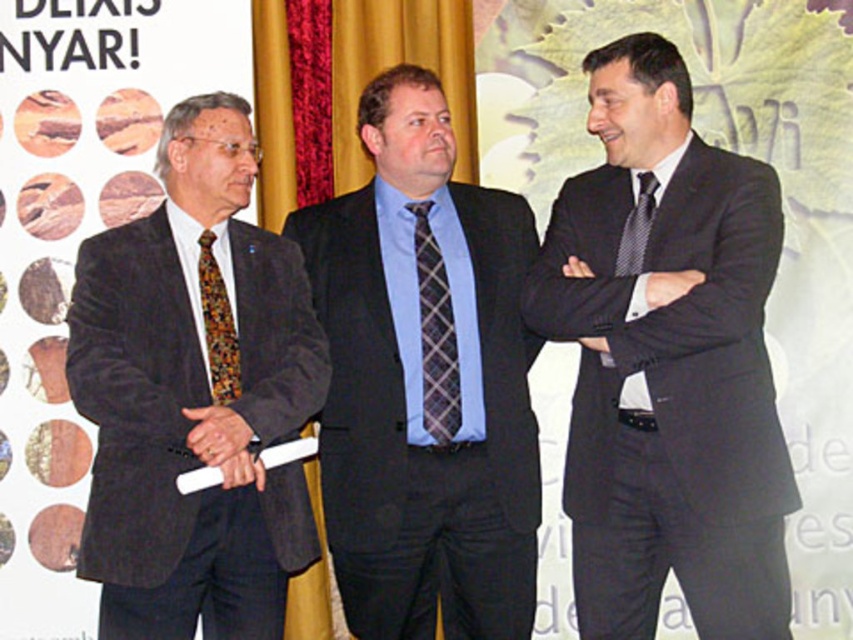
Question: Which object is positioned farthest from the dark gray suit at center?

Choices:
 (A) black fabric hand at center
 (B) white leather hand at center
 (C) matte black hand at center

Answer: (B)

Question: Which object appears farthest from the camera in this image?

Choices:
 (A) black silk tie at right
 (B) black textured tie at center

Answer: (B)

Question: Does black textured tie at center appear on the left side of black fabric hand at center?

Choices:
 (A) no
 (B) yes

Answer: (A)

Question: Which object appears closest to the camera in this image?

Choices:
 (A) black fabric hand at center
 (B) multicolored woven tie at left
 (C) black textured tie at center
 (D) black silk suit at center

Answer: (D)

Question: Does black silk suit at center lie in front of black silk tie at right?

Choices:
 (A) yes
 (B) no

Answer: (B)

Question: Where is dark gray suit at center located in relation to velvet brown suit at left in the image?

Choices:
 (A) above
 (B) below

Answer: (A)